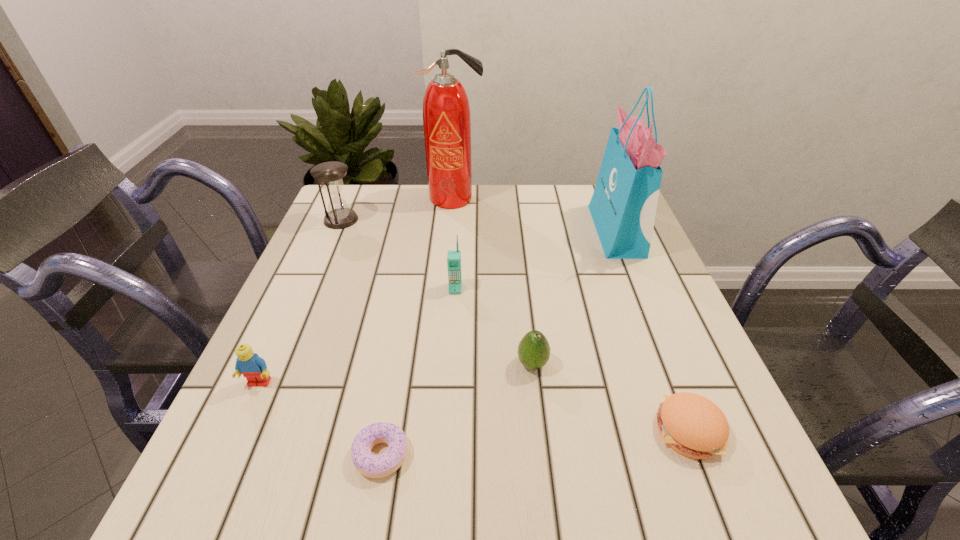
The width and height of the screenshot is (960, 540). Find the location of `free space at the left edge of the desktop`. free space at the left edge of the desktop is located at coordinates (281, 435).

Where is `vacant space at the right edge of the desktop`? vacant space at the right edge of the desktop is located at coordinates (613, 304).

In the image, there is a desktop. Find the location of `vacant area at the far left corner`. vacant area at the far left corner is located at coordinates (352, 205).

What are the coordinates of `free space that is in between the patty and the hourglass` in the screenshot? It's located at (515, 325).

Find the location of a particular element. free area in between the second shortest object and the shopping bag is located at coordinates (653, 330).

Where is `empty space that is in between the sixth object from left to right and the hourglass`? empty space that is in between the sixth object from left to right and the hourglass is located at coordinates (437, 292).

Locate an element on the screen. The width and height of the screenshot is (960, 540). free space between the second shortest object and the hourglass is located at coordinates (515, 325).

You are a GUI agent. You are given a task and a screenshot of the screen. Output one action in this format:
    pyautogui.click(x=<x>, y=<y>)
    Task: Click on the vacant space that is in between the fourth farthest object and the second shortest object
    This screenshot has width=960, height=540.
    Given the screenshot: What is the action you would take?
    pyautogui.click(x=572, y=359)

What are the coordinates of `empty space that is in between the Lego and the second shortest object` in the screenshot? It's located at (474, 406).

I want to click on vacant space in between the sixth object from left to right and the fire extinguisher, so click(493, 281).